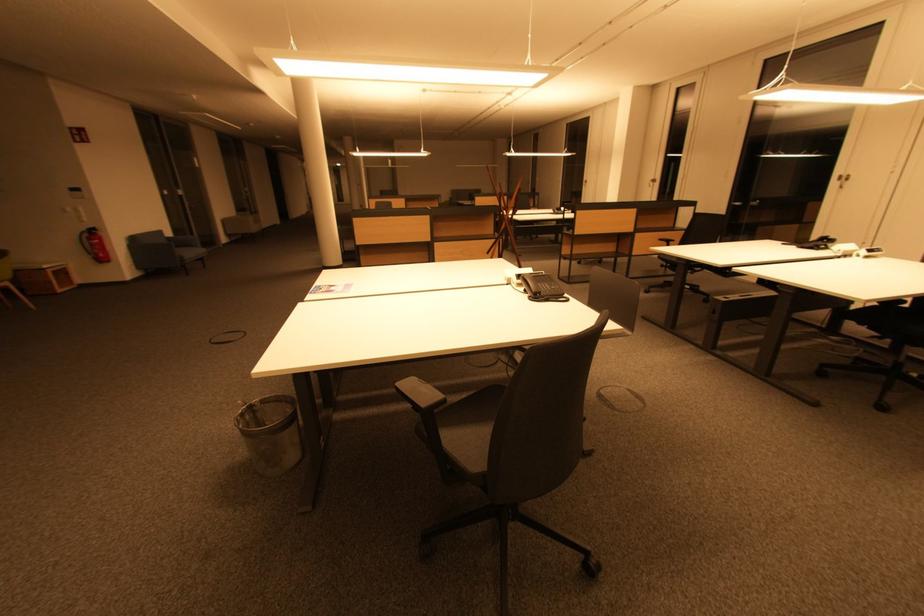
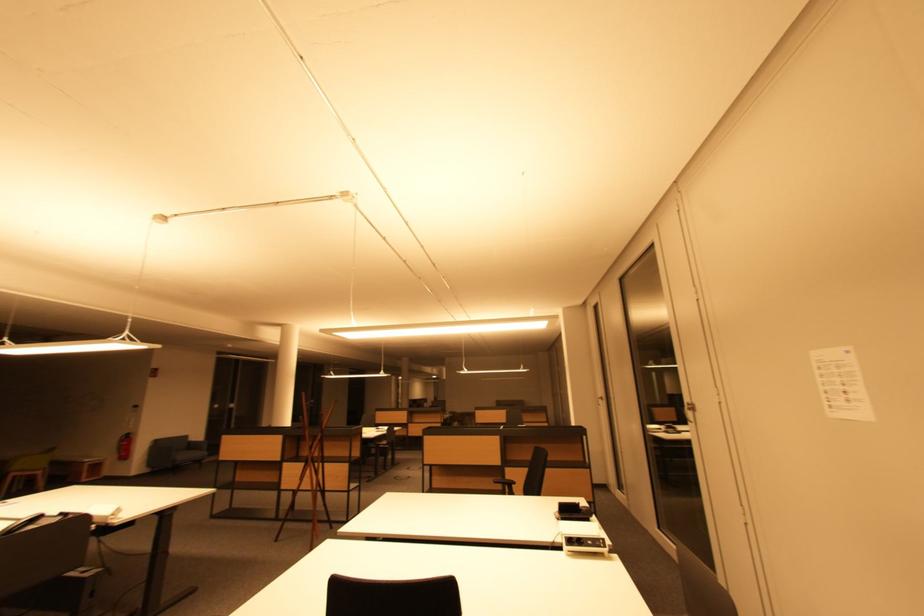
Locate, in the second image, the point that corresponds to (105,259) in the first image.

(128, 458)